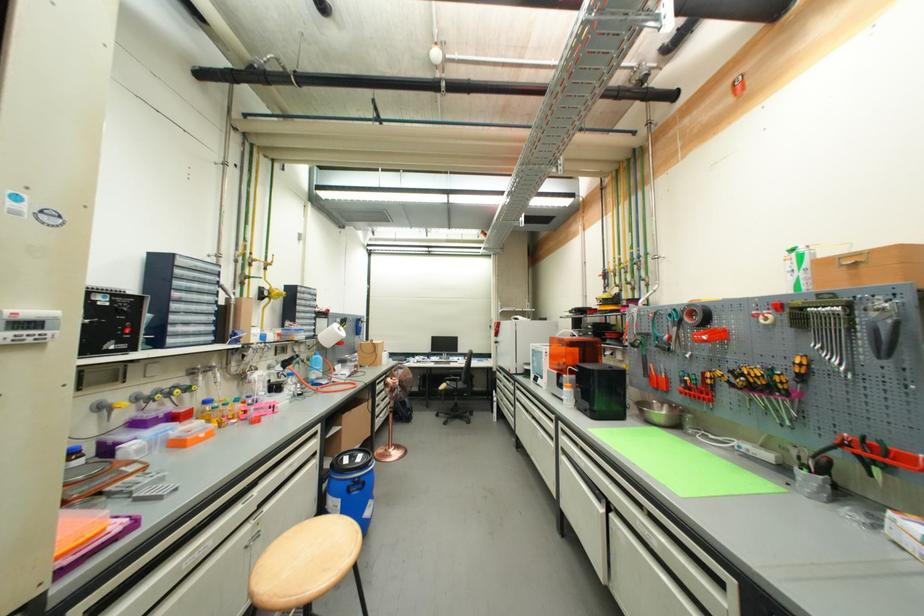
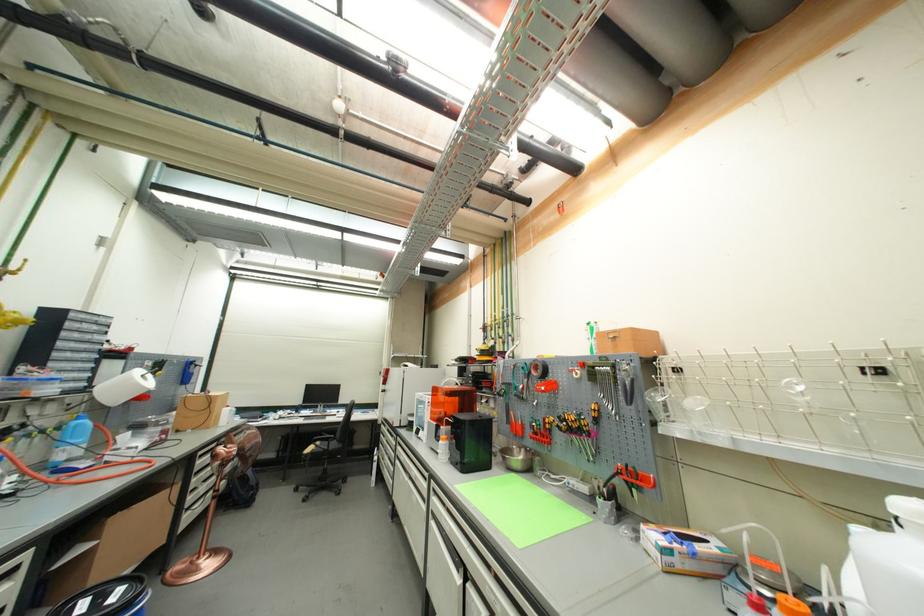
The point at [566,450] is marked in the first image. Where is the corresponding point in the second image?

(438, 513)